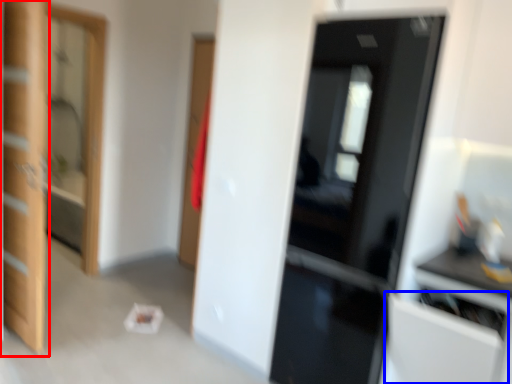
Question: Which object appears closest to the camera in this image, door (highlighted by a red box) or cabinetry (highlighted by a blue box)?

Choices:
 (A) door
 (B) cabinetry

Answer: (B)